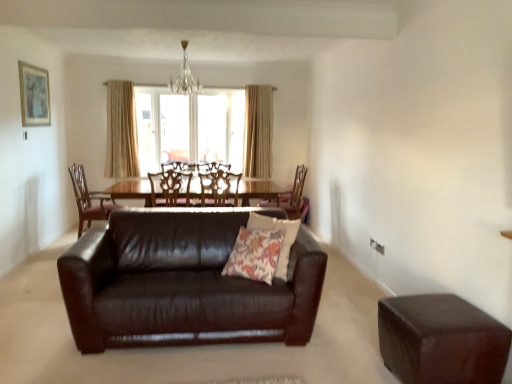
Question: From a real-world perspective, is matte wooden picture frame at upper left physically located above or below crystal glass chandelier at upper center?

Choices:
 (A) below
 (B) above

Answer: (A)

Question: Is matte wooden picture frame at upper left situated inside crystal glass chandelier at upper center or outside?

Choices:
 (A) inside
 (B) outside

Answer: (B)

Question: Which object is positioned farthest from the wooden chair at center, marked as the 4th chair in a left-to-right arrangement?

Choices:
 (A) translucent glass window at center
 (B) wooden chair at center, the third chair from the left
 (C) brown leather chair at center, positioned as the 3th chair in right-to-left order
 (D) crystal glass chandelier at upper center
 (E) brown leather ottoman at lower right

Answer: (E)

Question: Based on their relative distances, which object is nearer to the beige fabric curtain at upper center, which ranks as the first curtain in left-to-right order?

Choices:
 (A) floral fabric pillow at center
 (B) crystal glass chandelier at upper center
 (C) wooden chair at center, which appears as the 2th chair when viewed from the right
 (D) brown leather couch at center
 (E) brown leather ottoman at lower right

Answer: (B)